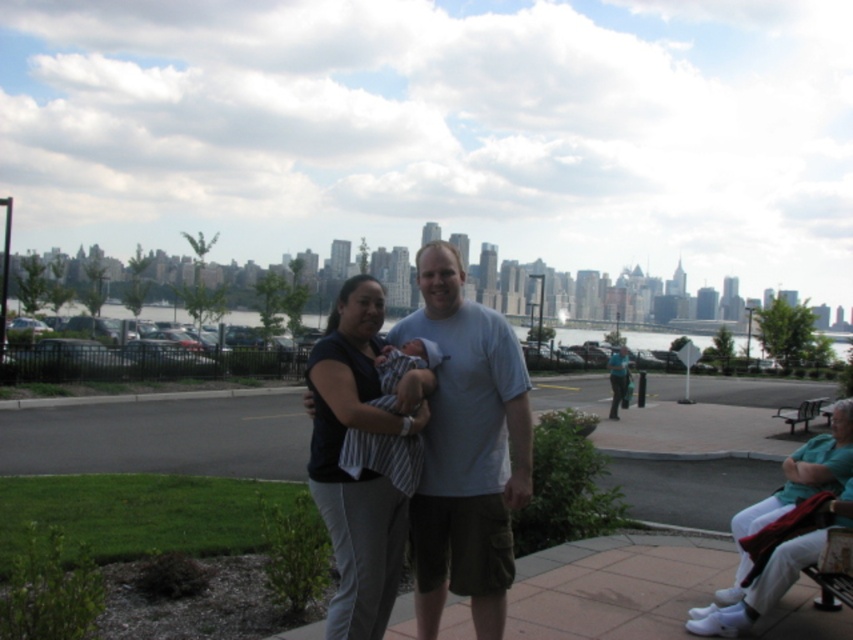
You are a photographer setting up a shot of the striped fabric baby at center and the metallic silver bench at lower right. You need to ensure both are in focus. Which object should you adjust your camera focus to prioritize for better clarity?

The metallic silver bench at lower right is taller than the striped fabric baby at center, so you should prioritize focusing on the metallic silver bench at lower right to ensure both are in focus.

In the scene shown: You are a photographer standing at the camera position. You want to capture a photo of the matte white shirt at center. Considering the distance between you and the shirt, can you focus on it clearly using a standard camera lens with a maximum focus distance of 50 feet?

The distance between the matte white shirt at center and the camera is 73.23 feet, which exceeds the maximum focus distance of 50 feet for the standard camera lens. Therefore, the camera cannot focus on the matte white shirt at center clearly.

You are standing at the point labeled point [814,406] and want to take a photo of the point labeled point [370,433]. Given that your camera has a maximum zoom range of 10 meters, can you capture the entire scene between these two points without moving?

Point [370,433] is closer to the camera than point [814,406]. The distance between them would require the camera to zoom out to include both points, but since the maximum zoom is 10 meters, it depends on the actual distance between them. However, based on the given information, we cannot determine if the zoom range is sufficient.